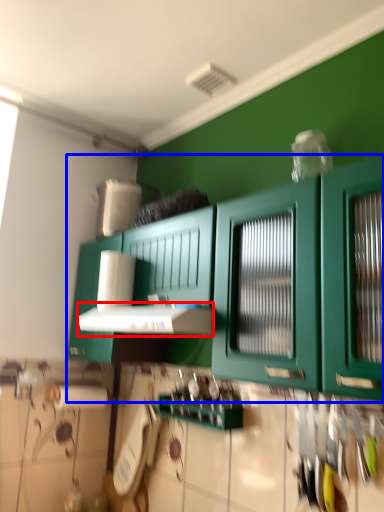
Question: Which point is closer to the camera, vent (highlighted by a red box) or cabinetry (highlighted by a blue box)?

Choices:
 (A) vent
 (B) cabinetry

Answer: (B)